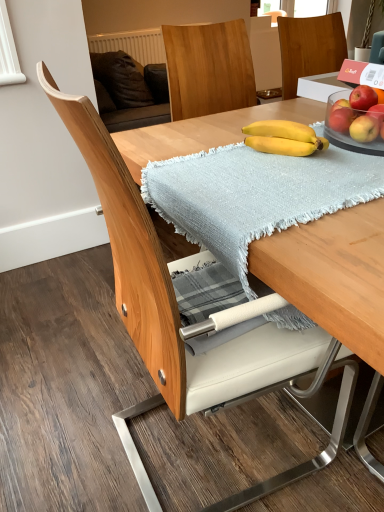
Question: From the image's perspective, is red matte apple at upper right, acting as the second apple starting from the bottom, above or below red matte apple at upper right, the 3th apple ordered from the bottom?

Choices:
 (A) below
 (B) above

Answer: (A)

Question: Is red matte apple at upper right, acting as the second apple starting from the bottom, bigger or smaller than red matte apple at upper right, the 3th apple ordered from the bottom?

Choices:
 (A) small
 (B) big

Answer: (A)

Question: Which of these objects is positioned closest to the red matte apple at upper right, the 3th apple in the top-to-bottom sequence?

Choices:
 (A) red matte apple at upper right, which is the 4th apple in bottom-to-top order
 (B) light blue woven blanket at center
 (C) red matte apple at upper right, the 3th apple ordered from the bottom
 (D) yellow matte bananas at center
 (E) matte yellow apple at right, which ranks as the 1th apple in bottom-to-top order

Answer: (A)

Question: Estimate the real-world distances between objects in this image. Which object is farther from the red matte apple at upper right, acting as the second apple starting from the bottom?

Choices:
 (A) red matte apple at upper right, the 3th apple ordered from the bottom
 (B) yellow matte bananas at center
 (C) matte yellow apple at right, which ranks as the 1th apple in bottom-to-top order
 (D) light blue woven blanket at center
 (E) red matte apple at upper right, arranged as the first apple when viewed from the top

Answer: (D)